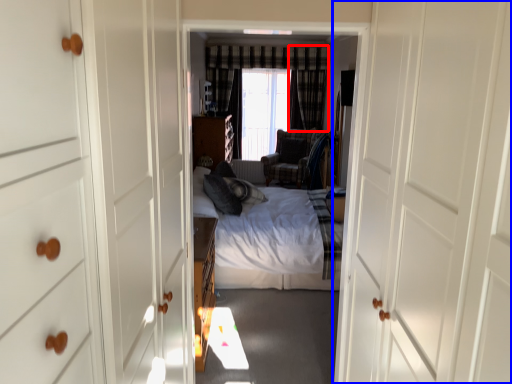
Question: Which object is further to the camera taking this photo, curtain (highlighted by a red box) or door (highlighted by a blue box)?

Choices:
 (A) curtain
 (B) door

Answer: (A)